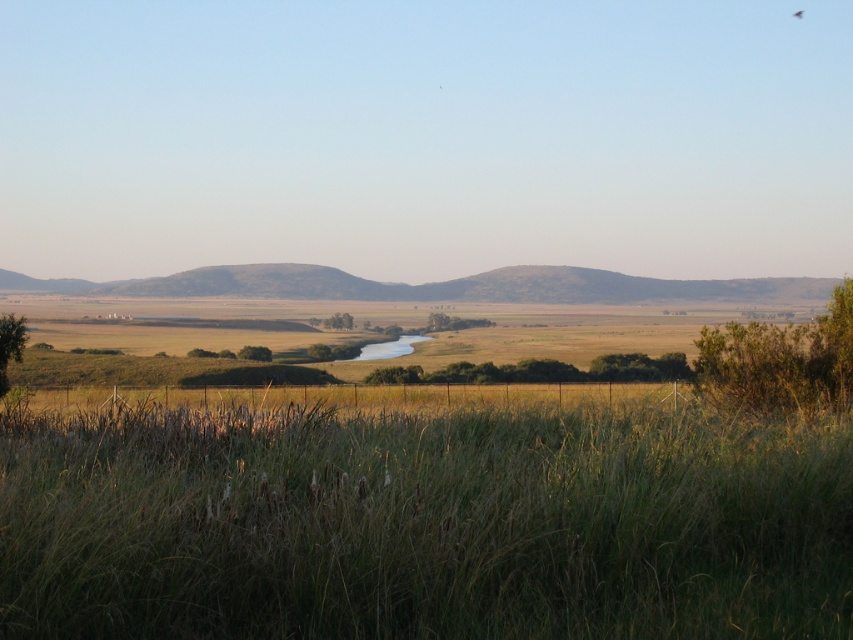
Consider the image. You are standing at the center of the grassland and see the point marked at coordinates (780, 362). What object is located at that point?

The point at coordinates (780, 362) corresponds to a green leafy bush at upper right.

You are standing in the middle of the grassland and see the green grassy at lower center and the green leafy tree at lower left. Which object is closer to you?

The green grassy at lower center is closer to you because it is positioned under the green leafy tree at lower left, indicating it is in front of the tree.

You are planning to set up a picnic area in the scene. You have two options for locations based on the green grassy at lower center and the green leafy tree at lower left. Which location would you choose if you want more space for your picnic setup?

You should choose the green leafy tree at lower left because it occupies more space than the green grassy at lower center, providing a larger area for the picnic setup.